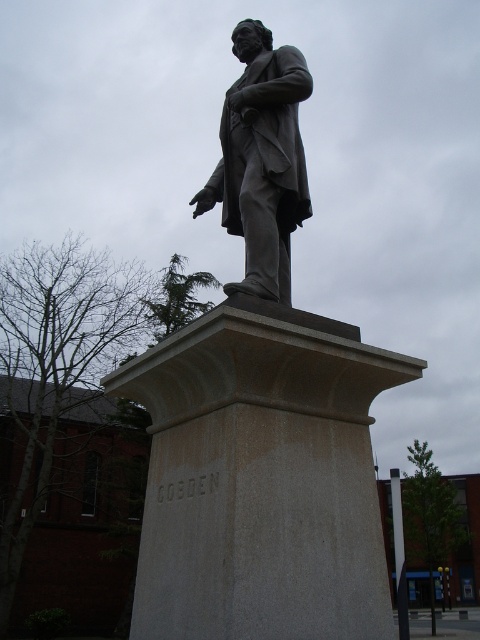
Question: Which point is farther to the camera?

Choices:
 (A) (295, 145)
 (B) (166, 560)

Answer: (A)

Question: Among these objects, which one is farthest from the camera?

Choices:
 (A) bronze statue at center
 (B) gray polished stone statue at center

Answer: (A)

Question: Among these points, which one is farthest from the camera?

Choices:
 (A) (304, 372)
 (B) (286, 51)

Answer: (B)

Question: Does gray polished stone statue at center have a smaller size compared to bronze statue at center?

Choices:
 (A) yes
 (B) no

Answer: (B)

Question: Does gray polished stone statue at center appear under bronze statue at center?

Choices:
 (A) yes
 (B) no

Answer: (A)

Question: Does gray polished stone statue at center have a larger size compared to bronze statue at center?

Choices:
 (A) no
 (B) yes

Answer: (B)